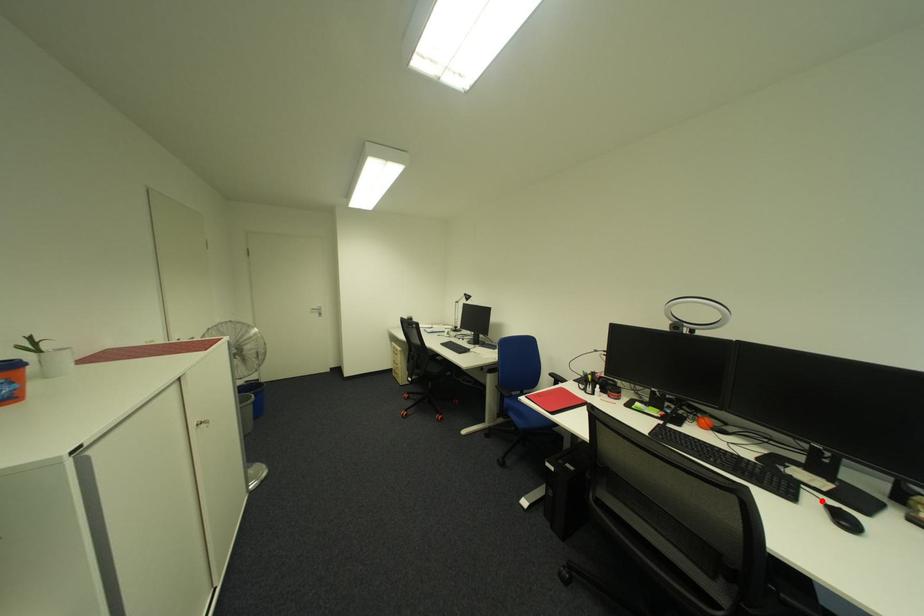
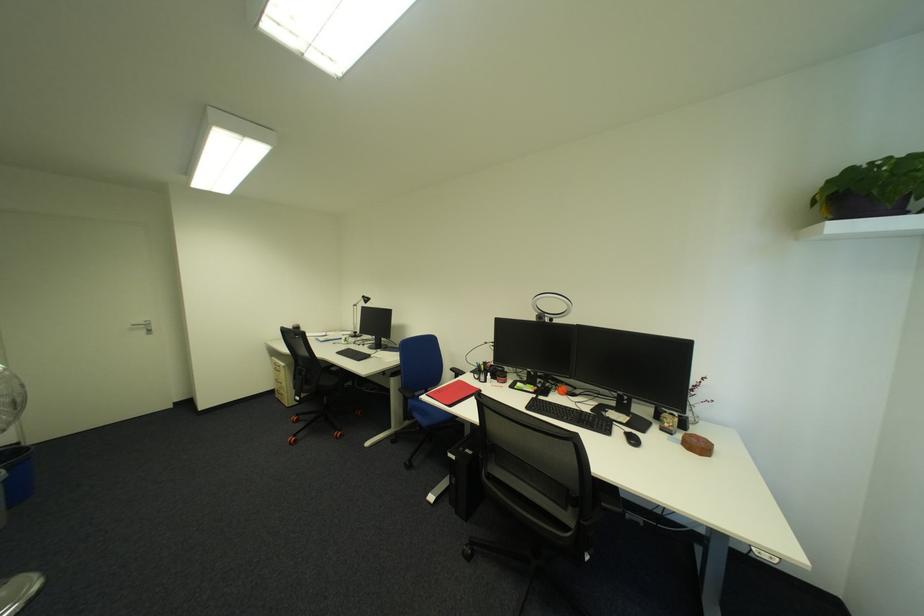
Find the pixel in the second image that matches the highlighted location in the first image.

(628, 432)